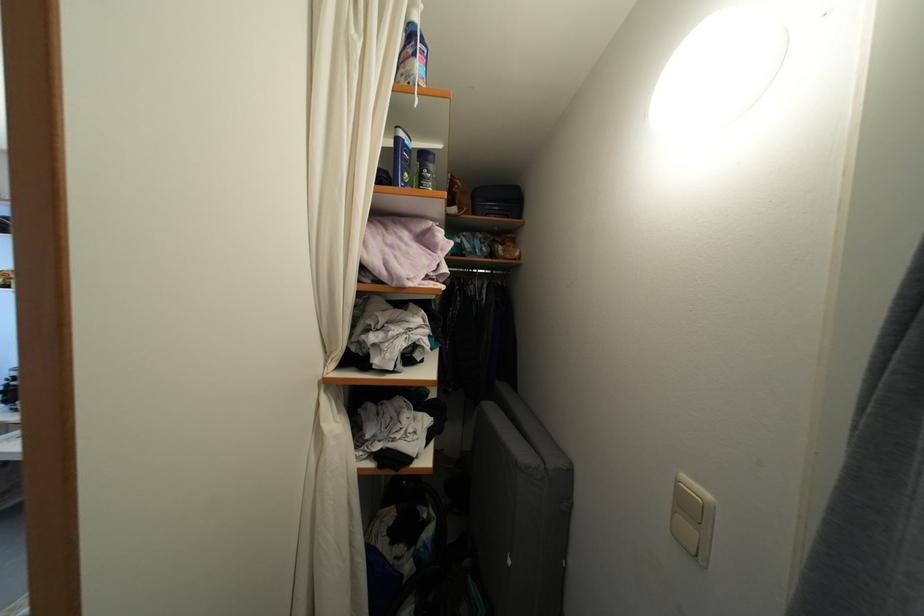
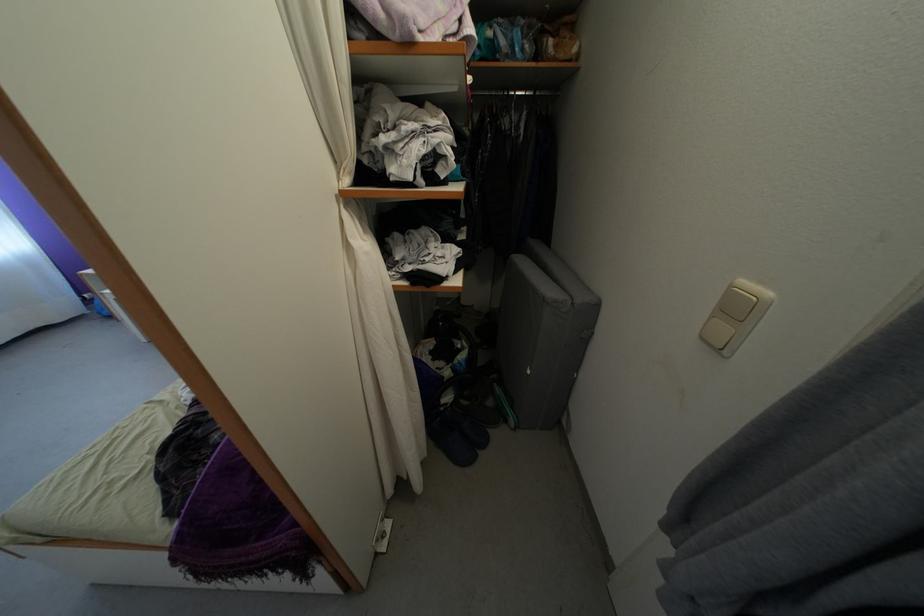
Locate, in the second image, the point that corresponds to (515,568) in the first image.

(535, 378)